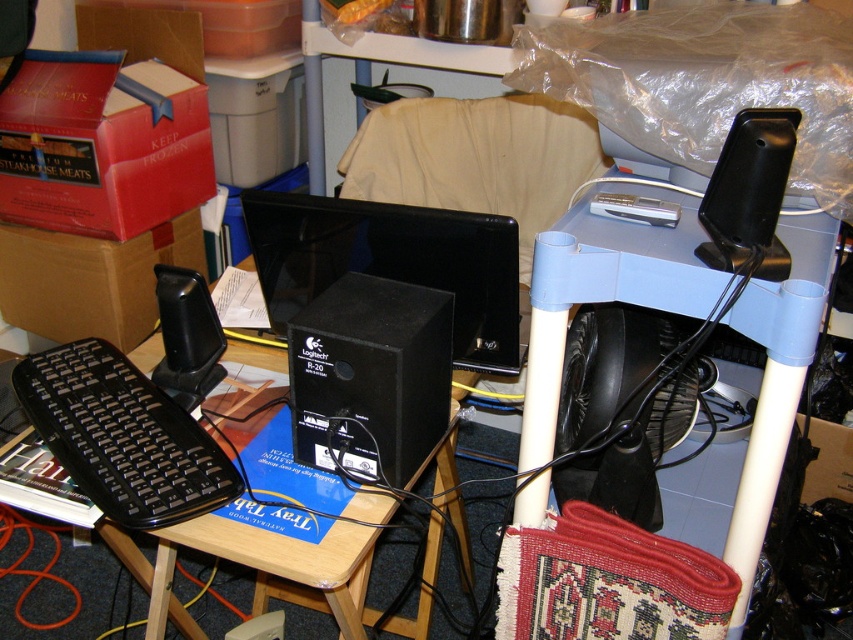
You are organizing the workspace and need to move the red cardboard box at upper left. If you move it forward, will the black glossy monitor at center become visible?

The black glossy monitor at center is currently behind the red cardboard box at upper left. Moving the red cardboard box at upper left forward would likely make the monitor more visible if it is no longer blocking it.

You are organizing items in a workspace and need to place a new item on the highest available surface. Which object should you choose between the red cardboard box at upper left and the black glossy monitor at center?

The red cardboard box at upper left is located above the black glossy monitor at center, so you should place the new item on the red cardboard box at upper left since it is the higher surface.

You are setting up a new monitor and need to place it on the desk. The current monitor is the black glossy monitor at center, and there is a matte cardboard box at left. Which object has a smaller width, requiring less desk space?

The black glossy monitor at center has a smaller width than the matte cardboard box at left, so it requires less desk space.